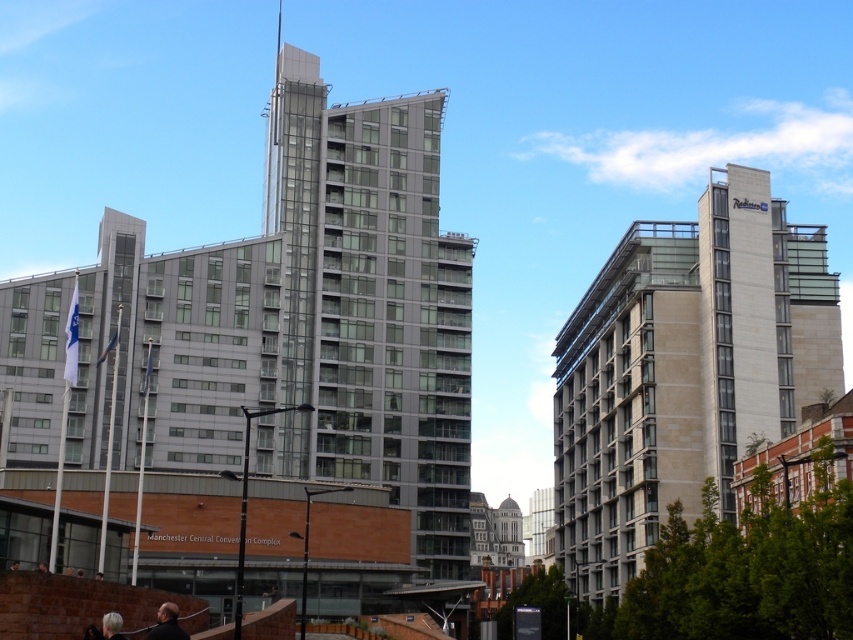
You are standing at the lower left corner of the image and see the glassy metallic building at center and the blonde hair at lower left. Which object is closer to your current position?

The blonde hair at lower left is closer to your current position because you are standing at the lower left corner, and the glassy metallic building at center is further away from you.

In the scene shown: You are standing at the center of the image and looking towards the beige stone building at right. Which direction should you turn to face the dark brown leather jacket at lower center?

The beige stone building at right is to the right of the dark brown leather jacket at lower center, so to face the dark brown leather jacket at lower center, you should turn to your left.

You are a delivery drone operator. Your drone is currently hovering above the glassy metallic building at center and needs to deliver a package to the dark brown leather jacket at lower center. Considering the height difference between the two objects, can your drone safely descend to make the delivery?

The glassy metallic building at center is taller than the dark brown leather jacket at lower center, so the drone can safely descend to the lower position of the dark brown leather jacket at lower center for delivery.